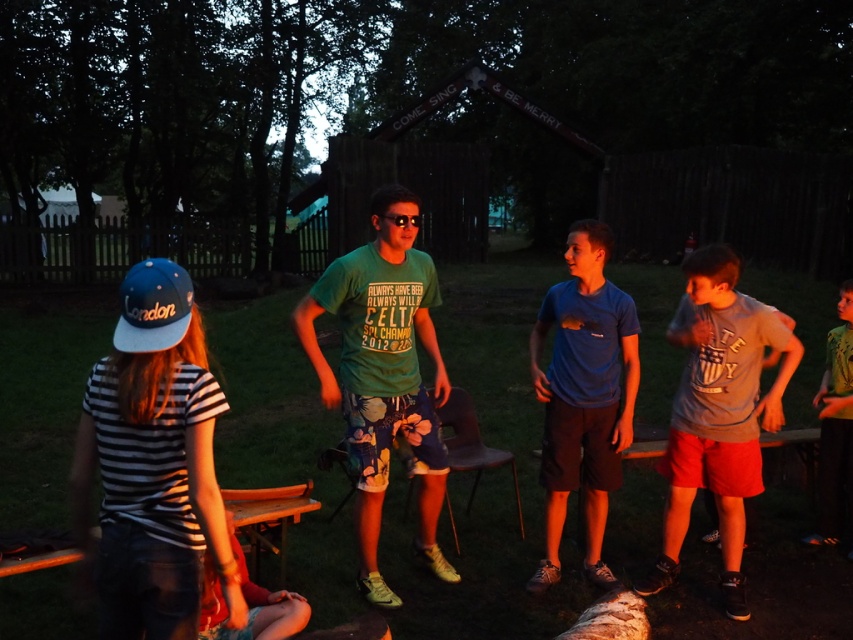
Question: Is green cotton t-shirt at center above green t-shirt at center?

Choices:
 (A) no
 (B) yes

Answer: (B)

Question: Among these objects, which one is nearest to the camera?

Choices:
 (A) gray cotton t-shirt at right
 (B) green cotton t-shirt at center

Answer: (B)

Question: Which point appears closest to the camera in this image?

Choices:
 (A) (639, 593)
 (B) (612, 372)
 (C) (849, 484)

Answer: (B)

Question: Is gray cotton t-shirt at right below green t-shirt at center?

Choices:
 (A) no
 (B) yes

Answer: (B)

Question: Does green cotton t-shirt at center appear under blue matte shirt at center?

Choices:
 (A) yes
 (B) no

Answer: (B)

Question: Which object appears farthest from the camera in this image?

Choices:
 (A) green cotton t-shirt at center
 (B) gray cotton t-shirt at right

Answer: (B)